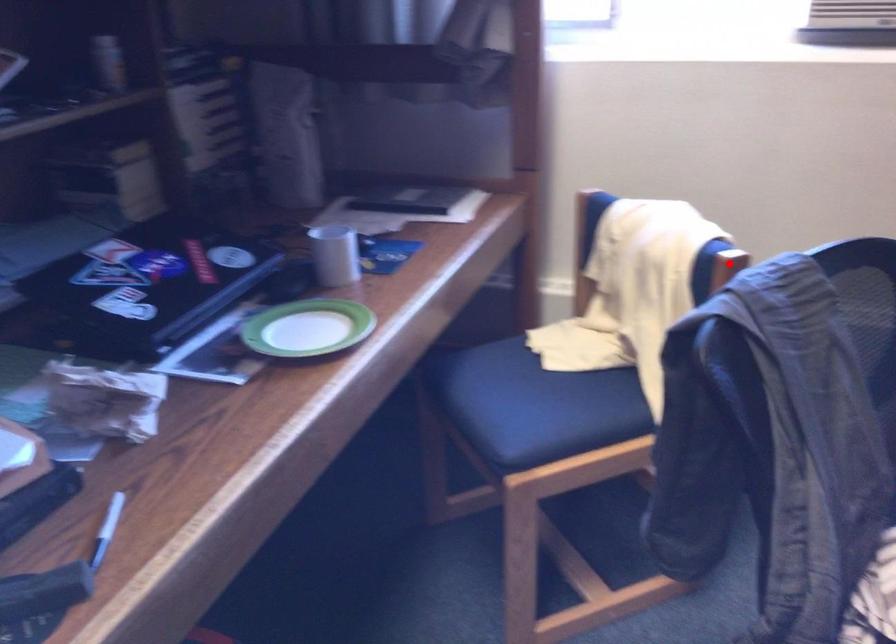
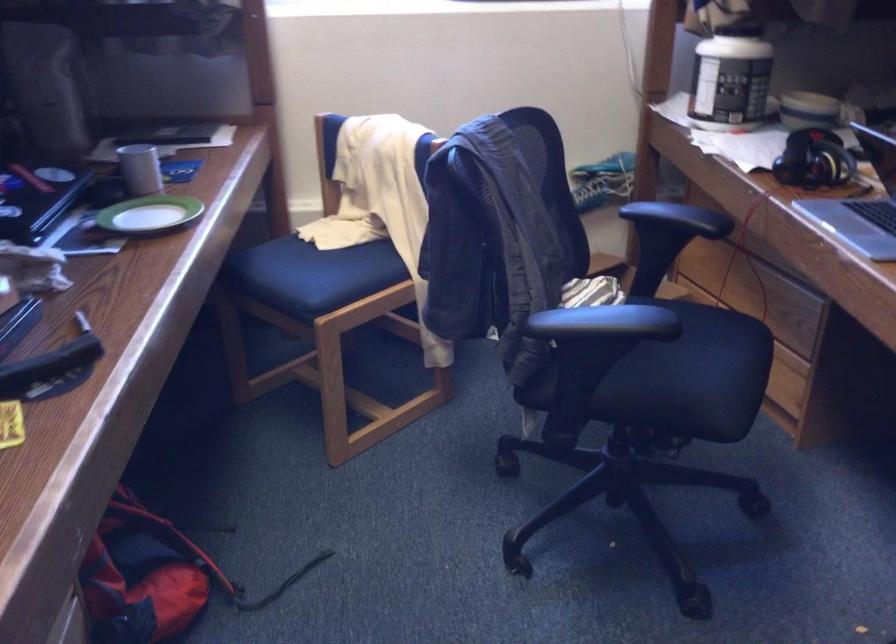
Question: I am providing you with two images of the same scene from different viewpoints. A red point is marked on the first image. Can you still see the location of the red point in image 2?

Choices:
 (A) Yes
 (B) No

Answer: (B)